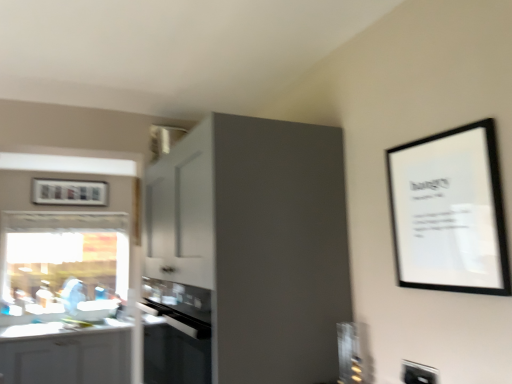
Question: Are black glass oven at center and white plastic electric outlet at lower right located far from each other?

Choices:
 (A) no
 (B) yes

Answer: (A)

Question: Considering the relative sizes of black glass oven at center and white plastic electric outlet at lower right in the image provided, is black glass oven at center bigger than white plastic electric outlet at lower right?

Choices:
 (A) yes
 (B) no

Answer: (A)

Question: From a real-world perspective, is black glass oven at center physically above white plastic electric outlet at lower right?

Choices:
 (A) no
 (B) yes

Answer: (A)

Question: From a real-world perspective, is black glass oven at center under white plastic electric outlet at lower right?

Choices:
 (A) yes
 (B) no

Answer: (A)

Question: Is black glass oven at center in front of white plastic electric outlet at lower right?

Choices:
 (A) no
 (B) yes

Answer: (A)

Question: Based on their sizes in the image, would you say white glossy cabinet at lower left, which is the 2th cabinetry from top to bottom, is bigger or smaller than black glass oven at center?

Choices:
 (A) big
 (B) small

Answer: (A)

Question: Considering their positions, is white glossy cabinet at lower left, placed as the second cabinetry when sorted from front to back, located in front of or behind black glass oven at center?

Choices:
 (A) behind
 (B) front

Answer: (A)

Question: Is point (113, 364) positioned closer to the camera than point (164, 372)?

Choices:
 (A) closer
 (B) farther

Answer: (B)

Question: Is white glossy cabinet at lower left, the 1th cabinetry positioned from the left, situated inside black glass oven at center or outside?

Choices:
 (A) inside
 (B) outside

Answer: (B)

Question: Considering the relative positions of transparent glass window at left and matte gray cabinet at upper center, which is the second cabinetry in left-to-right order, in the image provided, is transparent glass window at left to the left or to the right of matte gray cabinet at upper center, which is the second cabinetry in left-to-right order,?

Choices:
 (A) left
 (B) right

Answer: (A)

Question: Is point tap(56, 243) positioned closer to the camera than point tap(292, 220)?

Choices:
 (A) closer
 (B) farther

Answer: (B)

Question: From the image's perspective, is transparent glass window at left above or below matte gray cabinet at upper center, which is the 1th cabinetry from right to left?

Choices:
 (A) below
 (B) above

Answer: (A)

Question: Considering the positions of transparent glass window at left and matte gray cabinet at upper center, the first cabinetry in the top-to-bottom sequence, in the image, is transparent glass window at left taller or shorter than matte gray cabinet at upper center, the first cabinetry in the top-to-bottom sequence,?

Choices:
 (A) short
 (B) tall

Answer: (A)

Question: In terms of width, does matte gray cabinet at upper center, which appears as the 1th cabinetry when viewed from the front, look wider or thinner when compared to white plastic electric outlet at lower right?

Choices:
 (A) thin
 (B) wide

Answer: (B)

Question: Choose the correct answer: Is matte gray cabinet at upper center, which is the second cabinetry in left-to-right order, inside white plastic electric outlet at lower right or outside it?

Choices:
 (A) inside
 (B) outside

Answer: (B)